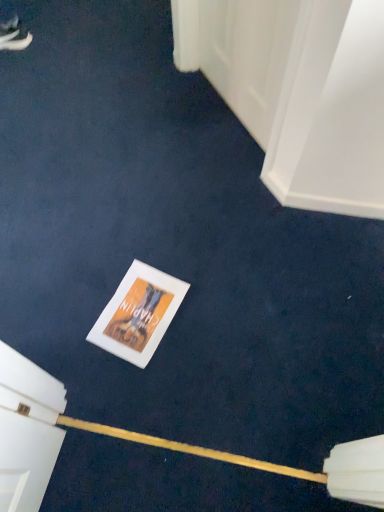
The height and width of the screenshot is (512, 384). Find the location of `free space to the left of white glossy picture frame at center`. free space to the left of white glossy picture frame at center is located at coordinates (54, 329).